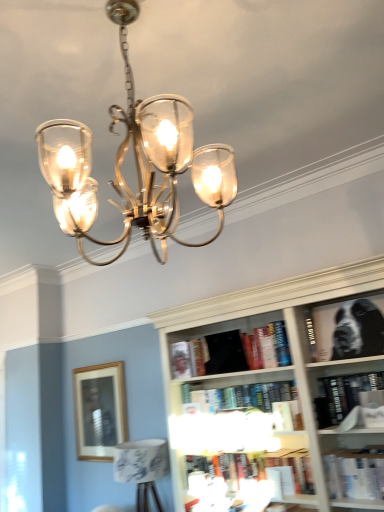
What is the approximate height of hardcover book at lower center, the 1th book positioned from the bottom?

8.18 inches.

Measure the distance between hardcover book at center, the 5th book viewed from the top, and camera.

The distance of hardcover book at center, the 5th book viewed from the top, from camera is 2.27 meters.

This screenshot has height=512, width=384. I want to click on black matte book at center, arranged as the 6th book when ordered from the bottom, so click(217, 353).

Identify the location of hardcover book at center, which ranks as the 3th book in top-to-bottom order. (188, 358).

The image size is (384, 512). Identify the location of hardcover book at center, acting as the 4th book starting from the top. (342, 396).

Find the location of `hardcover book at lower center, which is the 7th book from top to bottom`. hardcover book at lower center, which is the 7th book from top to bottom is located at coordinates (293, 468).

Looking at this image, is hardcover book at center, the 5th book viewed from the top, inside hardcover book at center, which appears as the 4th book when ordered from the bottom?

No.

Which is nearer, (341, 390) or (221, 400)?

Point (341, 390) appears to be closer to the viewer than point (221, 400).

Which is more to the left, hardcover book at center, acting as the 4th book starting from the top, or hardcover book at center, the 5th book viewed from the top?

Positioned to the left is hardcover book at center, the 5th book viewed from the top.

From a real-world perspective, between polished brass chandelier at upper center and wooden picture frame at center left, who is vertically higher?

From a 3D spatial view, polished brass chandelier at upper center is above.

Is polished brass chandelier at upper center not within wooden picture frame at center left?

That's correct, polished brass chandelier at upper center is outside of wooden picture frame at center left.

Is polished brass chandelier at upper center turned away from wooden picture frame at center left?

That's not correct — polished brass chandelier at upper center is not looking away from wooden picture frame at center left.

Between point (168, 219) and point (79, 399), which one is positioned in front?

The point (168, 219) is more forward.

Is hardcover book at center, marked as the 5th book in a bottom-to-top arrangement, oriented towards white paper book at lower right, which is counted as the sixth book, starting from the top?

No.

Between hardcover book at center, which ranks as the 3th book in top-to-bottom order, and white paper book at lower right, which ranks as the second book in bottom-to-top order, which one has smaller size?

hardcover book at center, which ranks as the 3th book in top-to-bottom order, is smaller.

From a real-world perspective, between hardcover book at center, which ranks as the 3th book in top-to-bottom order, and white paper book at lower right, which is counted as the sixth book, starting from the top, who is vertically lower?

In real-world perspective, white paper book at lower right, which is counted as the sixth book, starting from the top, is lower.

Which object is positioned more to the left, hardcover book at center, marked as the 5th book in a bottom-to-top arrangement, or white paper book at lower right, which is counted as the sixth book, starting from the top?

Positioned to the left is hardcover book at center, marked as the 5th book in a bottom-to-top arrangement.

Is hardcover book at center, which appears as the 4th book when ordered from the bottom, with black matte bookshelf at upper right, placed as the seventh book when sorted from bottom to top?

No, hardcover book at center, which appears as the 4th book when ordered from the bottom, is not beside black matte bookshelf at upper right, placed as the seventh book when sorted from bottom to top.

Does point (346, 381) appear closer or farther from the camera than point (382, 337)?

Point (346, 381) is farther from the camera than point (382, 337).

From a real-world perspective, is hardcover book at center, which appears as the 4th book when ordered from the bottom, on top of black matte bookshelf at upper right, placed as the seventh book when sorted from bottom to top?

Actually, hardcover book at center, which appears as the 4th book when ordered from the bottom, is physically below black matte bookshelf at upper right, placed as the seventh book when sorted from bottom to top, in the real world.

Considering the relative sizes of hardcover book at center, acting as the 4th book starting from the top, and black matte bookshelf at upper right, positioned as the first book in top-to-bottom order, in the image provided, is hardcover book at center, acting as the 4th book starting from the top, wider than black matte bookshelf at upper right, positioned as the first book in top-to-bottom order,?

Yes.

From the image's perspective, is wooden picture frame at center left positioned above or below white paper book at lower right, which is counted as the sixth book, starting from the top?

wooden picture frame at center left is situated lower than white paper book at lower right, which is counted as the sixth book, starting from the top, in the image.

Considering the relative sizes of wooden picture frame at center left and white paper book at lower right, which is counted as the sixth book, starting from the top, in the image provided, is wooden picture frame at center left thinner than white paper book at lower right, which is counted as the sixth book, starting from the top,?

Indeed, wooden picture frame at center left has a lesser width compared to white paper book at lower right, which is counted as the sixth book, starting from the top.

Is wooden picture frame at center left far away from white paper book at lower right, which is counted as the sixth book, starting from the top?

Absolutely, wooden picture frame at center left is distant from white paper book at lower right, which is counted as the sixth book, starting from the top.

Considering the sizes of objects wooden picture frame at center left and white paper book at lower right, which ranks as the second book in bottom-to-top order, in the image provided, who is shorter, wooden picture frame at center left or white paper book at lower right, which ranks as the second book in bottom-to-top order,?

Standing shorter between the two is white paper book at lower right, which ranks as the second book in bottom-to-top order.

From the picture: Is hardcover book at center, marked as the 5th book in a bottom-to-top arrangement, taller than hardcover book at center, which appears as the 4th book when ordered from the bottom?

No.

From a real-world perspective, is hardcover book at center, which ranks as the 3th book in top-to-bottom order, beneath hardcover book at center, which appears as the 4th book when ordered from the bottom?

No.

Does hardcover book at center, which ranks as the 3th book in top-to-bottom order, contain hardcover book at center, acting as the 4th book starting from the top?

No, hardcover book at center, acting as the 4th book starting from the top, is not surrounded by hardcover book at center, which ranks as the 3th book in top-to-bottom order.

At what (x,y) coordinates should I click in order to perform the action: click on the 2nd book located beneath the hardcover book at center, which ranks as the 3th book in top-to-bottom order (from a real-world perspective). Please return your answer as a coordinate pair (x, y). Looking at the image, I should click on (342, 396).

Is hardcover book at center, acting as the 4th book starting from the top, at the back of wooden picture frame at center left?

wooden picture frame at center left does not have its back to hardcover book at center, acting as the 4th book starting from the top.

Is wooden picture frame at center left next to hardcover book at center, which appears as the 4th book when ordered from the bottom?

No, wooden picture frame at center left is not making contact with hardcover book at center, which appears as the 4th book when ordered from the bottom.

Starting from the wooden picture frame at center left, which book is the 7th one to the right? Please provide its 2D coordinates.

[(342, 396)]

Which object is further away from the camera taking this photo, wooden picture frame at center left or hardcover book at center, which appears as the 4th book when ordered from the bottom?

wooden picture frame at center left is more distant.

Find the location of `book that is the 1st one when counting downward from the hardcover book at center, which appears as the 4th book when ordered from the bottom (from the image's perspective)`. book that is the 1st one when counting downward from the hardcover book at center, which appears as the 4th book when ordered from the bottom (from the image's perspective) is located at coordinates (249, 401).

Where is `lamp above the wooden picture frame at center left (from the image's perspective)`? lamp above the wooden picture frame at center left (from the image's perspective) is located at coordinates (135, 163).

Considering their positions, is hardcover book at lower center, which is the 7th book from top to bottom, positioned further to hardcover book at center, marked as the 5th book in a bottom-to-top arrangement, than hardcover book at center, which ranks as the 3th book in bottom-to-top order?

hardcover book at lower center, which is the 7th book from top to bottom.

Which object lies further to the anchor point black matte book at center, arranged as the 6th book when ordered from the bottom, polished brass chandelier at upper center or white paper book at lower right, which ranks as the second book in bottom-to-top order?

polished brass chandelier at upper center is positioned further to the anchor black matte book at center, arranged as the 6th book when ordered from the bottom.

Considering their positions, is wooden picture frame at center left positioned closer to polished brass chandelier at upper center than hardcover book at center, the 5th book viewed from the top?

Based on the image, hardcover book at center, the 5th book viewed from the top, appears to be nearer to polished brass chandelier at upper center.

From the image, which object appears to be nearer to black matte book at center, arranged as the 6th book when ordered from the bottom, hardcover book at center, acting as the 4th book starting from the top, or wooden picture frame at center left?

The object closer to black matte book at center, arranged as the 6th book when ordered from the bottom, is hardcover book at center, acting as the 4th book starting from the top.

Based on their spatial positions, is wooden picture frame at center left or black matte bookshelf at upper right, placed as the seventh book when sorted from bottom to top, further from hardcover book at center, which ranks as the 3th book in top-to-bottom order?

Based on the image, wooden picture frame at center left appears to be further to hardcover book at center, which ranks as the 3th book in top-to-bottom order.

When comparing their distances from hardcover book at center, which ranks as the 3th book in bottom-to-top order, does white paper book at lower right, which is counted as the sixth book, starting from the top, or wooden picture frame at center left seem closer?

white paper book at lower right, which is counted as the sixth book, starting from the top, is closer to hardcover book at center, which ranks as the 3th book in bottom-to-top order.

Which object lies nearer to the anchor point hardcover book at center, which appears as the 4th book when ordered from the bottom, white paper book at lower right, which is counted as the sixth book, starting from the top, or polished brass chandelier at upper center?

The object closer to hardcover book at center, which appears as the 4th book when ordered from the bottom, is white paper book at lower right, which is counted as the sixth book, starting from the top.

When comparing their distances from hardcover book at center, which ranks as the 3th book in bottom-to-top order, does wooden picture frame at center left or hardcover book at center, marked as the 5th book in a bottom-to-top arrangement, seem closer?

hardcover book at center, marked as the 5th book in a bottom-to-top arrangement.

In order to click on book between hardcover book at center, which ranks as the 3th book in bottom-to-top order, and hardcover book at center, which ranks as the 3th book in top-to-bottom order, in the front-back direction in this screenshot , I will do `click(217, 353)`.

Where is `book between wooden picture frame at center left and black matte book at center, arranged as the 6th book when ordered from the bottom, in the horizontal direction`? Image resolution: width=384 pixels, height=512 pixels. book between wooden picture frame at center left and black matte book at center, arranged as the 6th book when ordered from the bottom, in the horizontal direction is located at coordinates (188, 358).